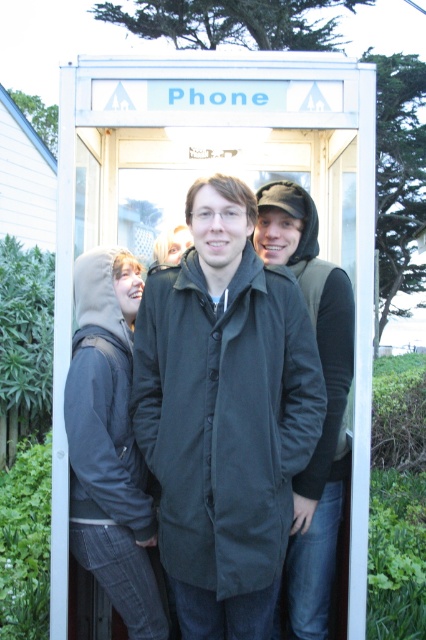
You are trying to determine if the dark gray hoodie at center can fit through the entrance of the metallic phone booth at center. Based on their sizes, can they enter?

The metallic phone booth at center is wider than the dark gray hoodie at center, so yes, the dark gray hoodie at center can fit through the entrance of the metallic phone booth at center.

You are standing in a park and see the phone booth at center. Can you determine if the phone booth at center is located to the left or right of the point marked at coordinates (227, 172)?

The metallic phone booth at center is represented by the point marked at coordinates (227, 172), so the phone booth at center is exactly at that point.

You are a delivery person who needs to place a small package inside the phone booth. The package must be placed at the exact center of the booth. The black matte coat at center is currently occupying the spot. Can you move the package to the center without disturbing the people inside?

The black matte coat at center is located at point (224, 413), which is very close to the center of the booth. However, since it is already occupying that spot, you would need to ask someone to move slightly so the package can be placed at the center.